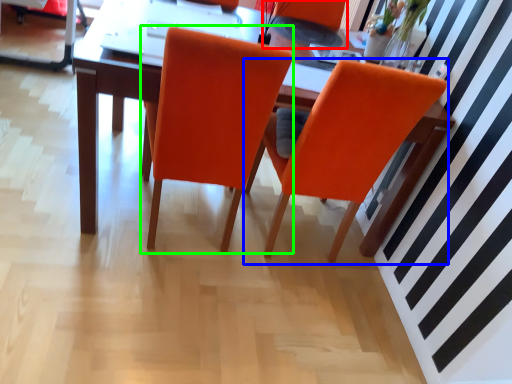
Question: Which object is positioned farthest from armchair (highlighted by a red box)? Select from chair (highlighted by a blue box) and chair (highlighted by a green box).

Choices:
 (A) chair
 (B) chair

Answer: (B)